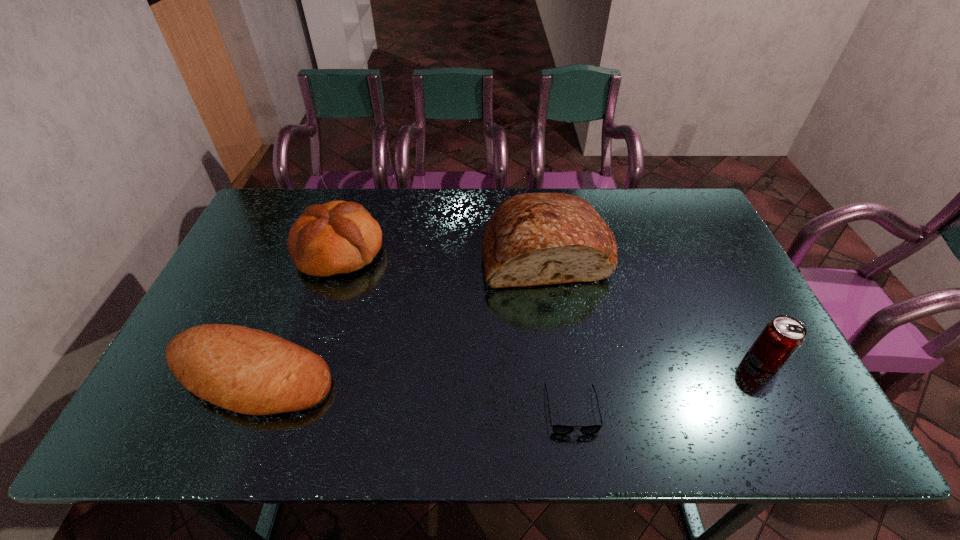
You are a GUI agent. You are given a task and a screenshot of the screen. Output one action in this format:
    pyautogui.click(x=<x>, y=<y>)
    Task: Click on the rightmost bread
    This screenshot has height=540, width=960.
    Given the screenshot: What is the action you would take?
    pyautogui.click(x=531, y=239)

The height and width of the screenshot is (540, 960). In order to click on the tallest bread in this screenshot , I will do `click(531, 239)`.

Identify the location of the second tallest bread. The image size is (960, 540). (337, 237).

Where is `pop soda`? Image resolution: width=960 pixels, height=540 pixels. pop soda is located at coordinates (781, 338).

This screenshot has height=540, width=960. In order to click on the second shortest object in this screenshot , I will do `click(248, 371)`.

The width and height of the screenshot is (960, 540). I want to click on the nearest bread, so 248,371.

At what (x,y) coordinates should I click in order to perform the action: click on the shortest object. Please return your answer as a coordinate pair (x, y). The height and width of the screenshot is (540, 960). Looking at the image, I should click on (558, 429).

Image resolution: width=960 pixels, height=540 pixels. I want to click on free space located at the sliced front of the rightmost bread, so click(x=572, y=421).

In order to click on free space located on the front of the second shortest bread in this screenshot , I will do `click(301, 367)`.

This screenshot has height=540, width=960. Find the location of `free space located 0.170m on the left of the rightmost object`. free space located 0.170m on the left of the rightmost object is located at coordinates (680, 360).